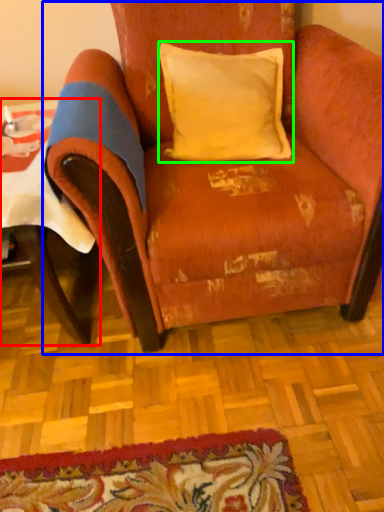
Question: Considering the real-world distances, which object is closest to table (highlighted by a red box)? chair (highlighted by a blue box) or pillow (highlighted by a green box).

Choices:
 (A) chair
 (B) pillow

Answer: (A)